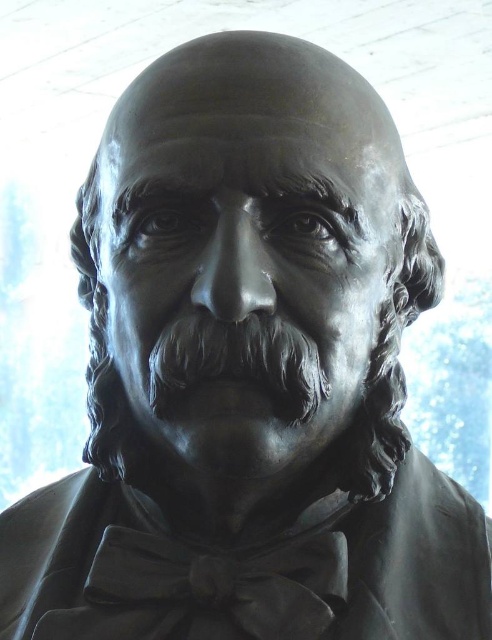
Question: Does black satin bow tie at center have a larger size compared to black matte beard at center?

Choices:
 (A) yes
 (B) no

Answer: (A)

Question: Which point appears farthest from the camera in this image?

Choices:
 (A) (117, 598)
 (B) (232, 340)

Answer: (A)

Question: Which of the following is the farthest from the observer?

Choices:
 (A) black matte beard at center
 (B) black satin bow tie at center

Answer: (B)

Question: Does black satin bow tie at center have a smaller size compared to black matte beard at center?

Choices:
 (A) no
 (B) yes

Answer: (A)

Question: Where is black satin bow tie at center located in relation to black matte beard at center in the image?

Choices:
 (A) right
 (B) left

Answer: (B)